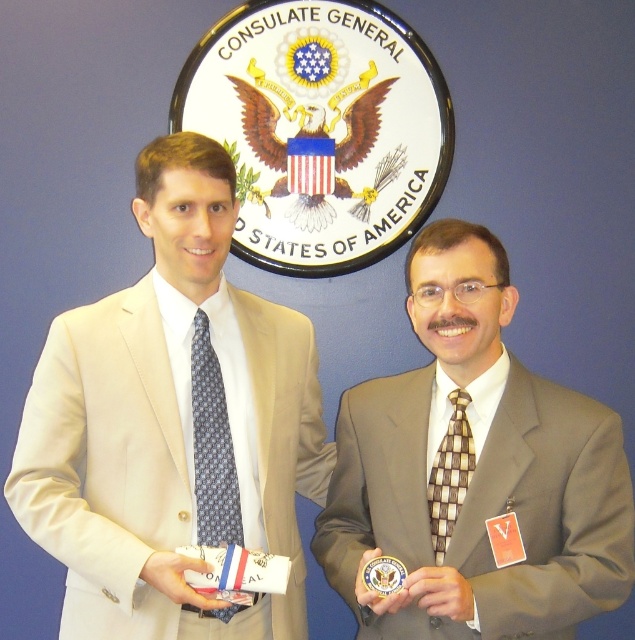
You are a photographer positioned at point A. You need to capture a photo of both the point at [439,401] and the point at [450,529] in the frame. However, you can only move forward or backward along the path. Which direction should you move to ensure both points are visible in the photo?

To capture both points in the photo, you should move backward because point [439,401] is behind point [450,529]. By moving backward, you can position yourself so that both points are within the camera frame.

What is located at the coordinates point (474, 472) in the image?

The brown textured suit at center is located at point (474, 472).